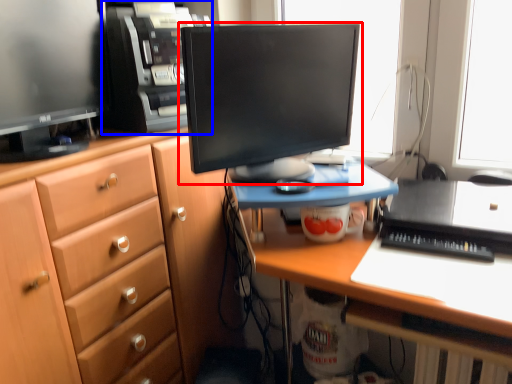
Question: Which point is further to the camera, computer monitor (highlighted by a red box) or computer tower (highlighted by a blue box)?

Choices:
 (A) computer monitor
 (B) computer tower

Answer: (B)